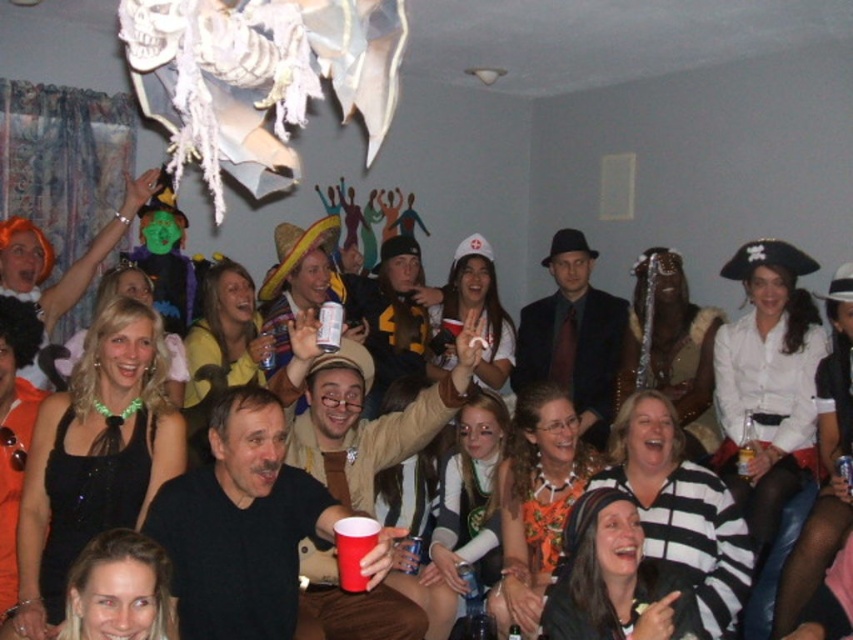
Is point (355, 563) positioned after point (334, 307)?

No.

Is rubber cup at lower center closer to camera compared to red plastic cup at center?

Yes, it is.

You are a GUI agent. You are given a task and a screenshot of the screen. Output one action in this format:
    pyautogui.click(x=<x>, y=<y>)
    Task: Click on the rubber cup at lower center
    Image resolution: width=853 pixels, height=640 pixels.
    Given the screenshot: What is the action you would take?
    pyautogui.click(x=352, y=548)

At what (x,y) coordinates should I click in order to perform the action: click on rubber cup at lower center. Please return your answer as a coordinate pair (x, y). The width and height of the screenshot is (853, 640). Looking at the image, I should click on (352, 548).

Which is behind, point (70, 412) or point (338, 525)?

The point (70, 412) is more distant.

How distant is black sequined dress at lower left from rubber cup at lower center?

A distance of 35.68 inches exists between black sequined dress at lower left and rubber cup at lower center.

Is point (51, 534) closer to viewer compared to point (345, 580)?

That is False.

At what (x,y) coordinates should I click in order to perform the action: click on black sequined dress at lower left. Please return your answer as a coordinate pair (x, y). The image size is (853, 640). Looking at the image, I should click on (90, 500).

Does point (363, 522) come in front of point (407, 550)?

Yes.

The height and width of the screenshot is (640, 853). I want to click on rubber cup at lower center, so tap(352, 548).

Where is `rubber cup at lower center`? The height and width of the screenshot is (640, 853). rubber cup at lower center is located at coordinates (352, 548).